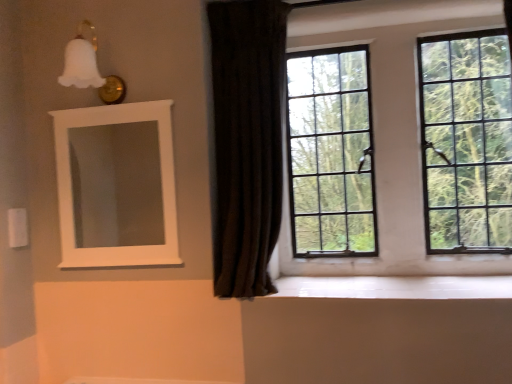
Question: Does white glossy wood at lower center have a greater height compared to dark velvet curtain at center?

Choices:
 (A) yes
 (B) no

Answer: (B)

Question: Is white glossy wood at lower center positioned beyond the bounds of dark velvet curtain at center?

Choices:
 (A) yes
 (B) no

Answer: (A)

Question: Is white glossy wood at lower center further to camera compared to dark velvet curtain at center?

Choices:
 (A) yes
 (B) no

Answer: (B)

Question: Does white glossy wood at lower center have a smaller size compared to dark velvet curtain at center?

Choices:
 (A) yes
 (B) no

Answer: (A)

Question: Is white glossy wood at lower center facing away from dark velvet curtain at center?

Choices:
 (A) no
 (B) yes

Answer: (A)

Question: In terms of width, does white matte medicine cabinet at upper left look wider or thinner when compared to white glossy wood at lower center?

Choices:
 (A) wide
 (B) thin

Answer: (B)

Question: Would you say white matte medicine cabinet at upper left is to the left or to the right of white glossy wood at lower center in the picture?

Choices:
 (A) left
 (B) right

Answer: (A)

Question: From a real-world perspective, relative to white glossy wood at lower center, is white matte medicine cabinet at upper left vertically above or below?

Choices:
 (A) above
 (B) below

Answer: (A)

Question: Relative to white glossy wood at lower center, is white matte medicine cabinet at upper left in front or behind?

Choices:
 (A) behind
 (B) front

Answer: (A)

Question: Based on their sizes in the image, would you say white matte medicine cabinet at upper left is bigger or smaller than clear glass window at upper right?

Choices:
 (A) small
 (B) big

Answer: (A)

Question: Based on their positions, is white matte medicine cabinet at upper left located to the left or right of clear glass window at upper right?

Choices:
 (A) right
 (B) left

Answer: (B)

Question: In the image, is white matte medicine cabinet at upper left positioned in front of or behind clear glass window at upper right?

Choices:
 (A) behind
 (B) front

Answer: (B)

Question: From a real-world perspective, is white matte medicine cabinet at upper left positioned above or below clear glass window at upper right?

Choices:
 (A) above
 (B) below

Answer: (B)

Question: Is white glossy wood at lower center in front of or behind white matte medicine cabinet at upper left in the image?

Choices:
 (A) front
 (B) behind

Answer: (A)

Question: Does point (476, 281) appear closer or farther from the camera than point (117, 274)?

Choices:
 (A) closer
 (B) farther

Answer: (A)